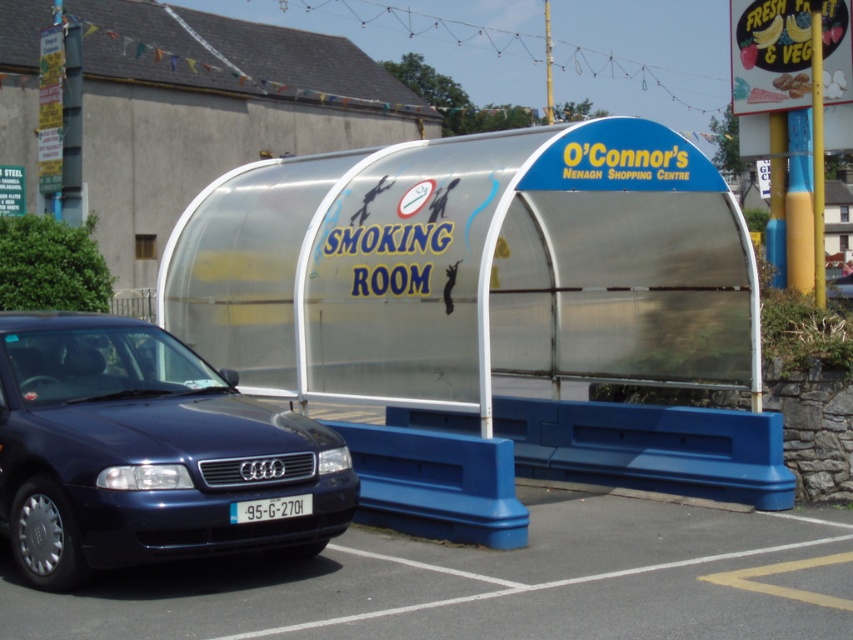
Question: Which point is farther to the camera?

Choices:
 (A) (242, 508)
 (B) (126, 444)
 (C) (257, 234)

Answer: (C)

Question: Can you confirm if smooth asphalt parking lot at lower left is positioned to the left of white plastic license plate at center?

Choices:
 (A) no
 (B) yes

Answer: (A)

Question: Which object is positioned farthest from the transparent plastic smoking room at center?

Choices:
 (A) white plastic license plate at center
 (B) metallic blue sedan at lower left

Answer: (B)

Question: Which point appears closest to the camera in this image?

Choices:
 (A) (451, 618)
 (B) (28, 412)
 (C) (242, 516)
 (D) (606, 320)

Answer: (A)

Question: Does metallic blue sedan at lower left have a greater width compared to white plastic license plate at center?

Choices:
 (A) yes
 (B) no

Answer: (A)

Question: Can you confirm if transparent plastic smoking room at center is thinner than white plastic license plate at center?

Choices:
 (A) yes
 (B) no

Answer: (B)